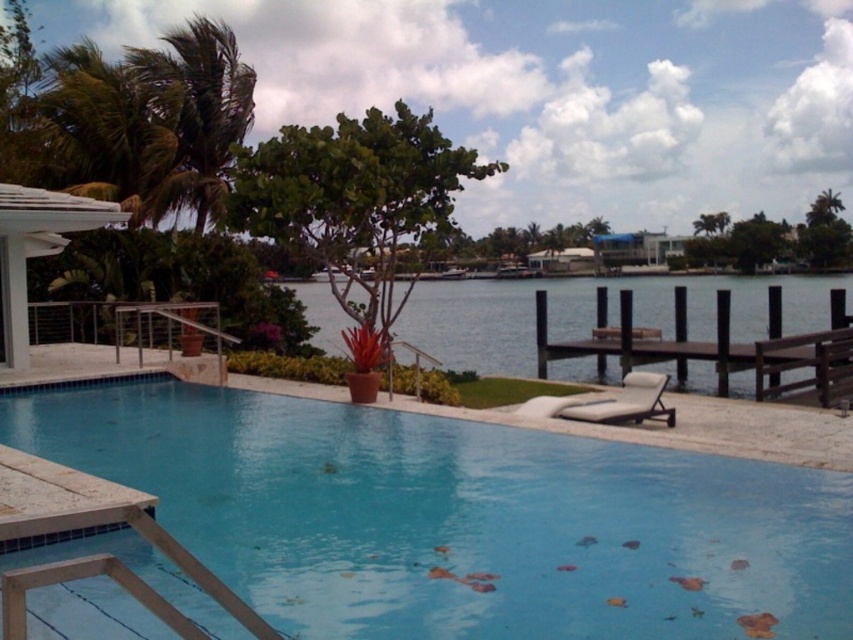
Can you confirm if blue wooden dock at center is positioned below brown wooden dock at lower right?

No, blue wooden dock at center is not below brown wooden dock at lower right.

Is blue wooden dock at center to the right of brown wooden dock at lower right from the viewer's perspective?

In fact, blue wooden dock at center is to the left of brown wooden dock at lower right.

Who is more distant from viewer, (735,388) or (712,346)?

Positioned behind is point (712,346).

This screenshot has height=640, width=853. In order to click on blue wooden dock at center in this screenshot , I will do `click(611, 323)`.

This screenshot has height=640, width=853. What do you see at coordinates (459, 518) in the screenshot?
I see `blue tile swimming pool at center` at bounding box center [459, 518].

Does blue tile swimming pool at center appear on the left side of white fabric daybed at lower right?

Indeed, blue tile swimming pool at center is positioned on the left side of white fabric daybed at lower right.

The image size is (853, 640). What do you see at coordinates (459, 518) in the screenshot?
I see `blue tile swimming pool at center` at bounding box center [459, 518].

Locate an element on the screen. The width and height of the screenshot is (853, 640). blue tile swimming pool at center is located at coordinates (459, 518).

In the scene shown: Which of these two, blue wooden dock at center or white fabric daybed at lower right, stands taller?

Standing taller between the two is blue wooden dock at center.

Which is behind, point (846, 282) or point (544, 400)?

Point (846, 282)

Where is `blue wooden dock at center`? blue wooden dock at center is located at coordinates (611, 323).